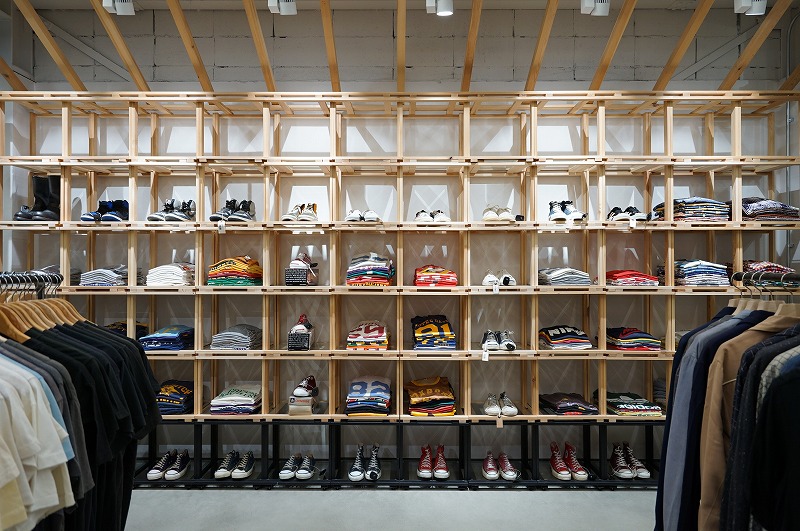
You are a GUI agent. You are given a task and a screenshot of the screen. Output one action in this format:
    pyautogui.click(x=<x>, y=<y>)
    Task: Click on the clothes on right display rack
    The image size is (800, 531).
    Given the screenshot: What is the action you would take?
    pyautogui.click(x=686, y=337), pyautogui.click(x=696, y=334), pyautogui.click(x=694, y=351), pyautogui.click(x=708, y=368), pyautogui.click(x=718, y=370), pyautogui.click(x=745, y=364), pyautogui.click(x=754, y=370), pyautogui.click(x=766, y=376), pyautogui.click(x=772, y=395), pyautogui.click(x=782, y=363)